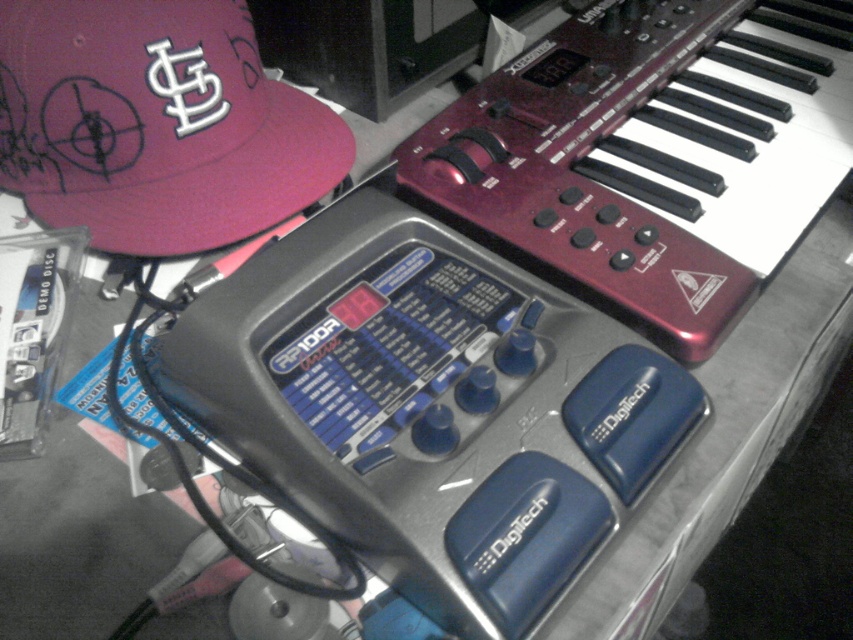
Is metallic red keyboard at upper right to the right of matte pink cap at upper left from the viewer's perspective?

Correct, you'll find metallic red keyboard at upper right to the right of matte pink cap at upper left.

Is metallic red keyboard at upper right above matte pink cap at upper left?

Yes, metallic red keyboard at upper right is above matte pink cap at upper left.

At what (x,y) coordinates should I click in order to perform the action: click on metallic red keyboard at upper right. Please return your answer as a coordinate pair (x, y). This screenshot has width=853, height=640. Looking at the image, I should click on (619, 154).